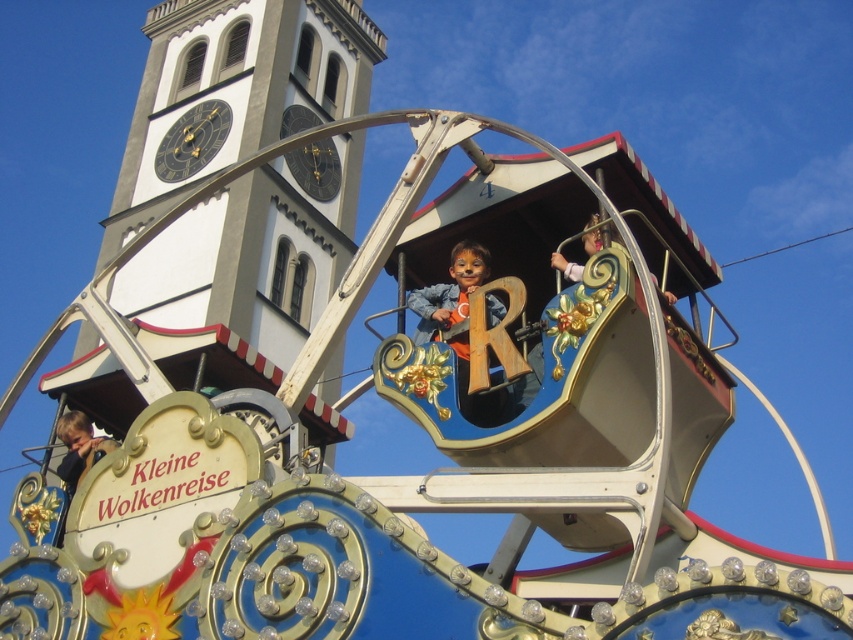
Question: Which point is closer to the camera?

Choices:
 (A) (57, 433)
 (B) (186, 104)
 (C) (534, 394)

Answer: (C)

Question: Considering the relative positions of white painted stone tower at upper center and wooden figure at upper center in the image provided, where is white painted stone tower at upper center located with respect to wooden figure at upper center?

Choices:
 (A) left
 (B) right

Answer: (A)

Question: Does white painted stone tower at upper center appear on the left side of wooden figure at upper center?

Choices:
 (A) yes
 (B) no

Answer: (A)

Question: Is white painted stone tower at upper center below wooden figure at upper center?

Choices:
 (A) no
 (B) yes

Answer: (A)

Question: Which point appears farthest from the camera in this image?

Choices:
 (A) (518, 384)
 (B) (65, 460)
 (C) (554, 268)

Answer: (B)

Question: Which point is closer to the camera?

Choices:
 (A) (666, 301)
 (B) (317, 70)
 (C) (73, 451)

Answer: (A)